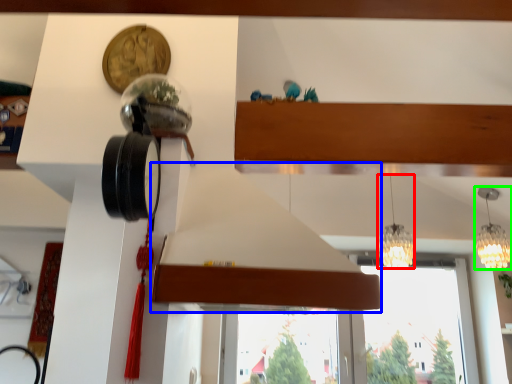
Question: Which is farther away from lamp (highlighted by a red box)? exhaust hood (highlighted by a blue box) or lamp (highlighted by a green box)?

Choices:
 (A) exhaust hood
 (B) lamp

Answer: (A)